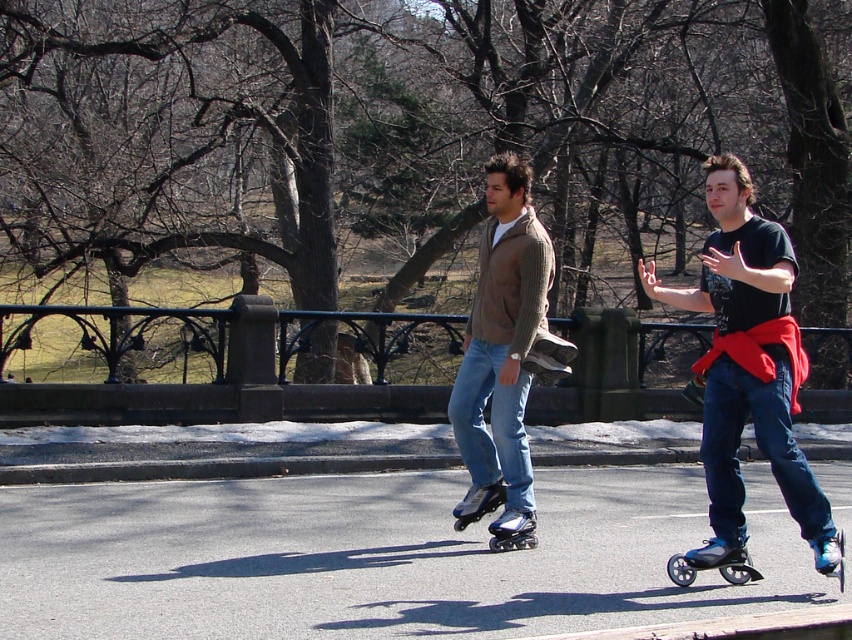
Between blue matte roller skates at right and knit sweater at center, which one appears on the left side from the viewer's perspective?

Positioned to the left is knit sweater at center.

Is blue matte roller skates at right smaller than knit sweater at center?

Actually, blue matte roller skates at right might be larger than knit sweater at center.

Measure the distance between point [718,365] and camera.

The distance of point [718,365] from camera is 6.90 meters.

This screenshot has height=640, width=852. Find the location of `blue matte roller skates at right`. blue matte roller skates at right is located at coordinates (746, 362).

Does knit sweater at center have a greater height compared to shiny blue roller skate at center?

Correct, knit sweater at center is much taller as shiny blue roller skate at center.

Is point (519, 243) less distant than point (478, 516)?

Yes, point (519, 243) is in front of point (478, 516).

Find the location of a particular element. The image size is (852, 640). knit sweater at center is located at coordinates (501, 346).

Is point (511, 529) positioned in front of point (479, 504)?

Yes, it is in front of point (479, 504).

Is shiny black roller skate at center thinner than shiny blue roller skate at center?

Indeed, shiny black roller skate at center has a lesser width compared to shiny blue roller skate at center.

Which is behind, point (513, 516) or point (479, 490)?

Positioned behind is point (479, 490).

Image resolution: width=852 pixels, height=640 pixels. What are the coordinates of `shiny black roller skate at center` in the screenshot? It's located at (513, 531).